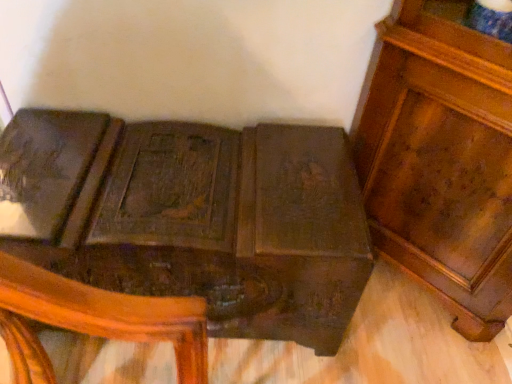
The width and height of the screenshot is (512, 384). Describe the element at coordinates (440, 158) in the screenshot. I see `glossy wood cabinet at upper right, the second furniture when ordered from left to right` at that location.

The height and width of the screenshot is (384, 512). In order to click on glossy wood cabinet at upper right, the second furniture when ordered from left to right in this screenshot , I will do `click(440, 158)`.

This screenshot has height=384, width=512. In order to click on dark wood carved trunk at center, which is the first furniture from left to right in this screenshot , I will do `click(193, 217)`.

In order to face dark wood carved trunk at center, which is the first furniture from left to right, should I rotate leftwards or rightwards?

A 10.444 degree turn to the left will do.

Describe the element at coordinates (193, 217) in the screenshot. I see `dark wood carved trunk at center, the 2th furniture viewed from the right` at that location.

Locate an element on the screen. glossy wood cabinet at upper right, which is the 1th furniture from right to left is located at coordinates (440, 158).

Considering the relative positions of dark wood carved trunk at center, the 2th furniture viewed from the right, and glossy wood cabinet at upper right, which is the 1th furniture from right to left, in the image provided, is dark wood carved trunk at center, the 2th furniture viewed from the right, to the right of glossy wood cabinet at upper right, which is the 1th furniture from right to left, from the viewer's perspective?

In fact, dark wood carved trunk at center, the 2th furniture viewed from the right, is to the left of glossy wood cabinet at upper right, which is the 1th furniture from right to left.

Who is more distant, dark wood carved trunk at center, the 2th furniture viewed from the right, or glossy wood cabinet at upper right, the second furniture when ordered from left to right?

Positioned behind is dark wood carved trunk at center, the 2th furniture viewed from the right.

Considering the positions of point (56, 214) and point (455, 236), is point (56, 214) closer or farther from the camera than point (455, 236)?

Point (56, 214) is positioned closer to the camera compared to point (455, 236).

From the image's perspective, which one is positioned higher, dark wood carved trunk at center, which is the first furniture from left to right, or glossy wood cabinet at upper right, which is the 1th furniture from right to left?

glossy wood cabinet at upper right, which is the 1th furniture from right to left.

From a real-world perspective, which object rests below the other?

In real-world perspective, dark wood carved trunk at center, the 2th furniture viewed from the right, is lower.

Considering the relative sizes of dark wood carved trunk at center, the 2th furniture viewed from the right, and glossy wood cabinet at upper right, which is the 1th furniture from right to left, in the image provided, is dark wood carved trunk at center, the 2th furniture viewed from the right, wider than glossy wood cabinet at upper right, which is the 1th furniture from right to left,?

Yes, dark wood carved trunk at center, the 2th furniture viewed from the right, is wider than glossy wood cabinet at upper right, which is the 1th furniture from right to left.

Between dark wood carved trunk at center, which is the first furniture from left to right, and glossy wood cabinet at upper right, which is the 1th furniture from right to left, which one has more height?

glossy wood cabinet at upper right, which is the 1th furniture from right to left, is taller.

Is dark wood carved trunk at center, which is the first furniture from left to right, smaller than glossy wood cabinet at upper right, the second furniture when ordered from left to right?

No, dark wood carved trunk at center, which is the first furniture from left to right, is not smaller than glossy wood cabinet at upper right, the second furniture when ordered from left to right.

Does dark wood carved trunk at center, the 2th furniture viewed from the right, contain glossy wood cabinet at upper right, which is the 1th furniture from right to left?

→ No, glossy wood cabinet at upper right, which is the 1th furniture from right to left, is located outside of dark wood carved trunk at center, the 2th furniture viewed from the right.

Is dark wood carved trunk at center, which is the first furniture from left to right, with glossy wood cabinet at upper right, the second furniture when ordered from left to right?

dark wood carved trunk at center, which is the first furniture from left to right, and glossy wood cabinet at upper right, the second furniture when ordered from left to right, are clearly separated.

Is dark wood carved trunk at center, the 2th furniture viewed from the right, facing away from glossy wood cabinet at upper right, which is the 1th furniture from right to left?

No, dark wood carved trunk at center, the 2th furniture viewed from the right, is not facing the opposite direction of glossy wood cabinet at upper right, which is the 1th furniture from right to left.

Can you tell me how much dark wood carved trunk at center, the 2th furniture viewed from the right, and glossy wood cabinet at upper right, which is the 1th furniture from right to left, differ in facing direction?

dark wood carved trunk at center, the 2th furniture viewed from the right, and glossy wood cabinet at upper right, which is the 1th furniture from right to left, are facing 44.8 degrees away from each other.

The image size is (512, 384). In order to click on furniture lying on the right of dark wood carved trunk at center, which is the first furniture from left to right in this screenshot , I will do `click(440, 158)`.

In the scene shown: Based on their positions, is glossy wood cabinet at upper right, which is the 1th furniture from right to left, located to the left or right of dark wood carved trunk at center, which is the first furniture from left to right?

Clearly, glossy wood cabinet at upper right, which is the 1th furniture from right to left, is on the right of dark wood carved trunk at center, which is the first furniture from left to right, in the image.

Which is behind, glossy wood cabinet at upper right, the second furniture when ordered from left to right, or dark wood carved trunk at center, the 2th furniture viewed from the right?

dark wood carved trunk at center, the 2th furniture viewed from the right, is further away from the camera.

Is point (377, 154) farther from viewer compared to point (213, 204)?

Yes, it is.

From the image's perspective, between glossy wood cabinet at upper right, the second furniture when ordered from left to right, and dark wood carved trunk at center, the 2th furniture viewed from the right, who is located below?

dark wood carved trunk at center, the 2th furniture viewed from the right, appears lower in the image.

From a real-world perspective, which object stands above the other?

glossy wood cabinet at upper right, the second furniture when ordered from left to right, from a real-world perspective.

Can you confirm if glossy wood cabinet at upper right, which is the 1th furniture from right to left, is wider than dark wood carved trunk at center, which is the first furniture from left to right?

In fact, glossy wood cabinet at upper right, which is the 1th furniture from right to left, might be narrower than dark wood carved trunk at center, which is the first furniture from left to right.

Who is shorter, glossy wood cabinet at upper right, the second furniture when ordered from left to right, or dark wood carved trunk at center, which is the first furniture from left to right?

Standing shorter between the two is dark wood carved trunk at center, which is the first furniture from left to right.

Looking at the image, does glossy wood cabinet at upper right, which is the 1th furniture from right to left, seem bigger or smaller compared to dark wood carved trunk at center, the 2th furniture viewed from the right?

In the image, glossy wood cabinet at upper right, which is the 1th furniture from right to left, appears to be smaller than dark wood carved trunk at center, the 2th furniture viewed from the right.

Is glossy wood cabinet at upper right, which is the 1th furniture from right to left, positioned beyond the bounds of dark wood carved trunk at center, which is the first furniture from left to right?

glossy wood cabinet at upper right, which is the 1th furniture from right to left, lies outside dark wood carved trunk at center, which is the first furniture from left to right,'s area.

Could you tell me if glossy wood cabinet at upper right, which is the 1th furniture from right to left, is turned towards dark wood carved trunk at center, the 2th furniture viewed from the right?

Yes.

In order to click on furniture on the left of glossy wood cabinet at upper right, which is the 1th furniture from right to left in this screenshot , I will do `click(193, 217)`.

Locate an element on the screen. The height and width of the screenshot is (384, 512). furniture that is behind the glossy wood cabinet at upper right, which is the 1th furniture from right to left is located at coordinates (193, 217).

Where is `furniture on the left of glossy wood cabinet at upper right, the second furniture when ordered from left to right`? The width and height of the screenshot is (512, 384). furniture on the left of glossy wood cabinet at upper right, the second furniture when ordered from left to right is located at coordinates [x=193, y=217].